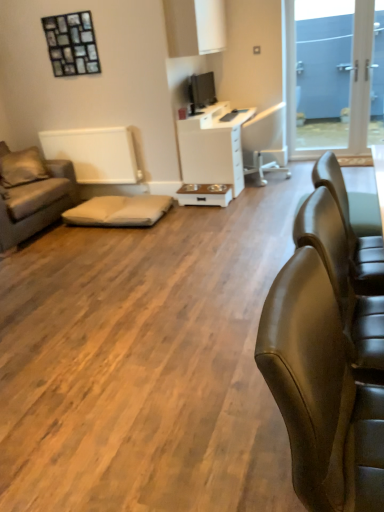
Locate an element on the screen. vacant area in front of beige fabric cushion at center is located at coordinates (98, 248).